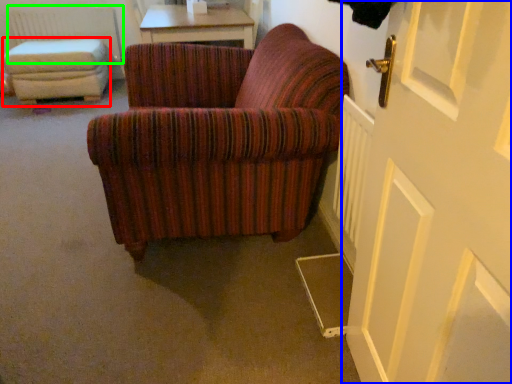
Question: Estimate the real-world distances between objects in this image. Which object is closer to stool (highlighted by a red box), door (highlighted by a blue box) or radiator (highlighted by a green box)?

Choices:
 (A) door
 (B) radiator

Answer: (B)